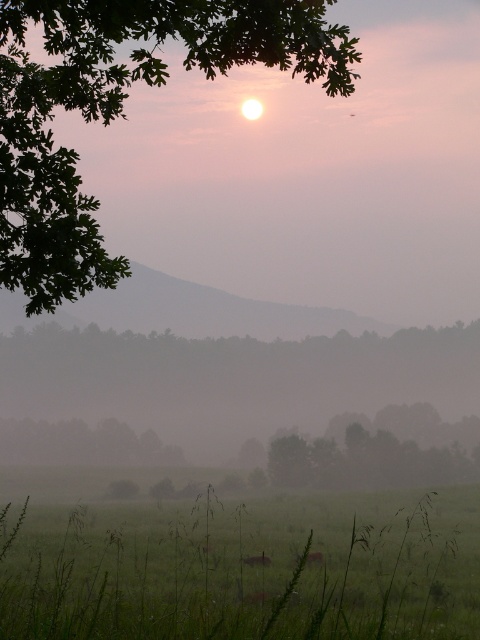
Question: Which of the following is the closest to the observer?

Choices:
 (A) (255, 557)
 (B) (39, 458)

Answer: (A)

Question: Which point is closer to the camera?

Choices:
 (A) (311, 563)
 (B) (84, 461)

Answer: (A)

Question: Does green matte tree at center have a greater width compared to green matte tree at lower left?

Choices:
 (A) yes
 (B) no

Answer: (A)

Question: Which point appears farthest from the camera in this image?

Choices:
 (A) (469, 474)
 (B) (259, 560)
 (C) (411, 618)

Answer: (A)

Question: Is green leafy tree at upper left positioned at the back of fluffy pink flower at lower center?

Choices:
 (A) yes
 (B) no

Answer: (A)

Question: Where is green matte tree at center located in relation to brown furry rabbit at center in the image?

Choices:
 (A) left
 (B) right

Answer: (B)